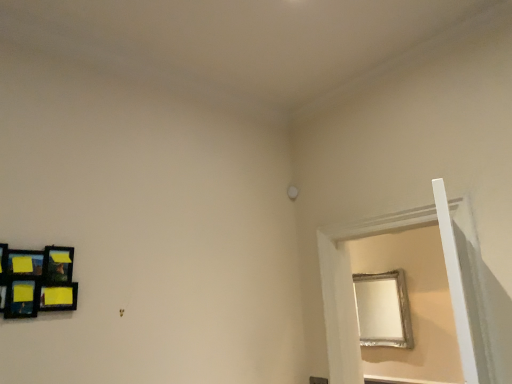
Question: Is silver metallic frame at right beside wooden-framed collage at left?

Choices:
 (A) yes
 (B) no

Answer: (B)

Question: Can you confirm if silver metallic frame at right is thinner than wooden-framed collage at left?

Choices:
 (A) yes
 (B) no

Answer: (B)

Question: From the image's perspective, is silver metallic frame at right located beneath wooden-framed collage at left?

Choices:
 (A) yes
 (B) no

Answer: (A)

Question: Considering the relative sizes of silver metallic frame at right and wooden-framed collage at left in the image provided, is silver metallic frame at right taller than wooden-framed collage at left?

Choices:
 (A) yes
 (B) no

Answer: (A)

Question: Does silver metallic frame at right have a larger size compared to wooden-framed collage at left?

Choices:
 (A) yes
 (B) no

Answer: (A)

Question: Could you tell me if silver metallic frame at right is facing wooden-framed collage at left?

Choices:
 (A) yes
 (B) no

Answer: (A)

Question: Considering the relative positions of wooden-framed collage at left and silver metallic frame at right in the image provided, is wooden-framed collage at left behind silver metallic frame at right?

Choices:
 (A) yes
 (B) no

Answer: (B)

Question: Would you say wooden-framed collage at left is outside silver metallic frame at right?

Choices:
 (A) no
 (B) yes

Answer: (B)

Question: From a real-world perspective, is wooden-framed collage at left on top of silver metallic frame at right?

Choices:
 (A) no
 (B) yes

Answer: (B)

Question: Is silver metallic frame at right surrounded by wooden-framed collage at left?

Choices:
 (A) no
 (B) yes

Answer: (A)

Question: Is wooden-framed collage at left wider than silver metallic frame at right?

Choices:
 (A) no
 (B) yes

Answer: (A)

Question: From the image's perspective, is wooden-framed collage at left located above silver metallic frame at right?

Choices:
 (A) no
 (B) yes

Answer: (B)

Question: Does point (332, 345) appear closer or farther from the camera than point (53, 296)?

Choices:
 (A) farther
 (B) closer

Answer: (A)